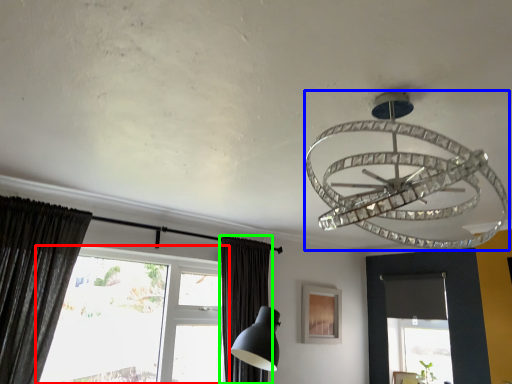
Question: Based on their relative distances, which object is farther from window (highlighted by a red box)? Choose from lamp (highlighted by a blue box) and curtain (highlighted by a green box).

Choices:
 (A) lamp
 (B) curtain

Answer: (A)